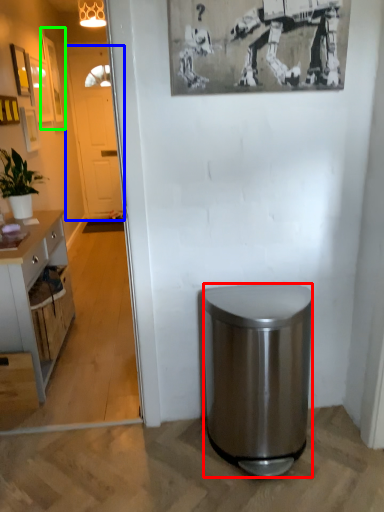
Question: Which object is positioned closest to trash bin/can (highlighted by a red box)? Select from glass door (highlighted by a blue box) and picture frame (highlighted by a green box).

Choices:
 (A) glass door
 (B) picture frame

Answer: (B)